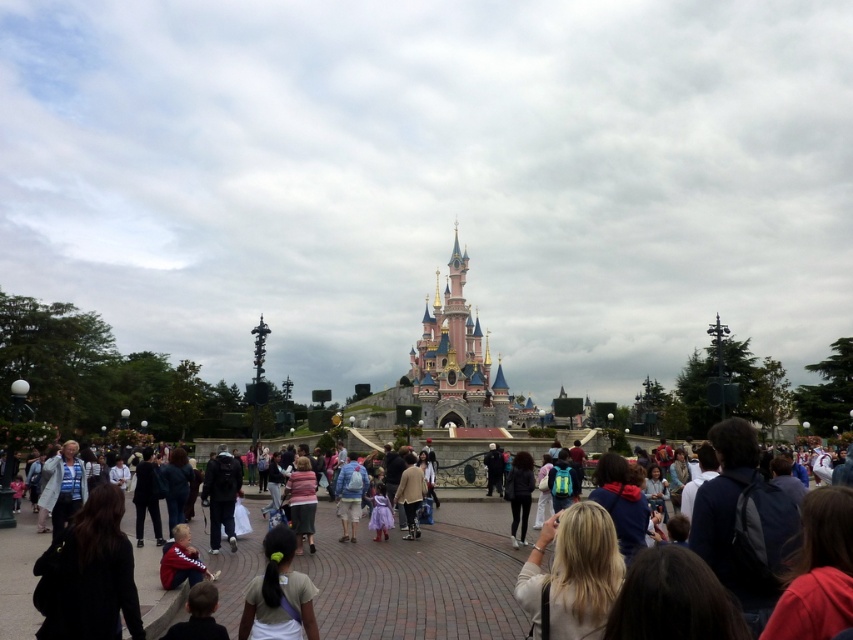
Between red fleece jacket at center and light blue fabric jacket at lower left, which one has less height?

red fleece jacket at center

Does point (607, 468) lie behind point (68, 445)?

No, (607, 468) is closer to viewer.

Between point (624, 532) and point (54, 516), which one is positioned behind?

Positioned behind is point (54, 516).

Identify the location of red fleece jacket at center. The width and height of the screenshot is (853, 640). (621, 502).

Does red fleece jacket at center have a lesser height compared to striped sweater at center?

Correct, red fleece jacket at center is not as tall as striped sweater at center.

This screenshot has height=640, width=853. What do you see at coordinates (621, 502) in the screenshot? I see `red fleece jacket at center` at bounding box center [621, 502].

Find the location of a particular element. red fleece jacket at center is located at coordinates (621, 502).

Which is behind, point (524, 467) or point (402, 493)?

The point (524, 467) is more distant.

Image resolution: width=853 pixels, height=640 pixels. In order to click on black matte jacket at center in this screenshot , I will do `click(519, 493)`.

Who is more forward, (524, 483) or (421, 492)?

Positioned in front is point (421, 492).

This screenshot has height=640, width=853. I want to click on black matte jacket at center, so click(x=519, y=493).